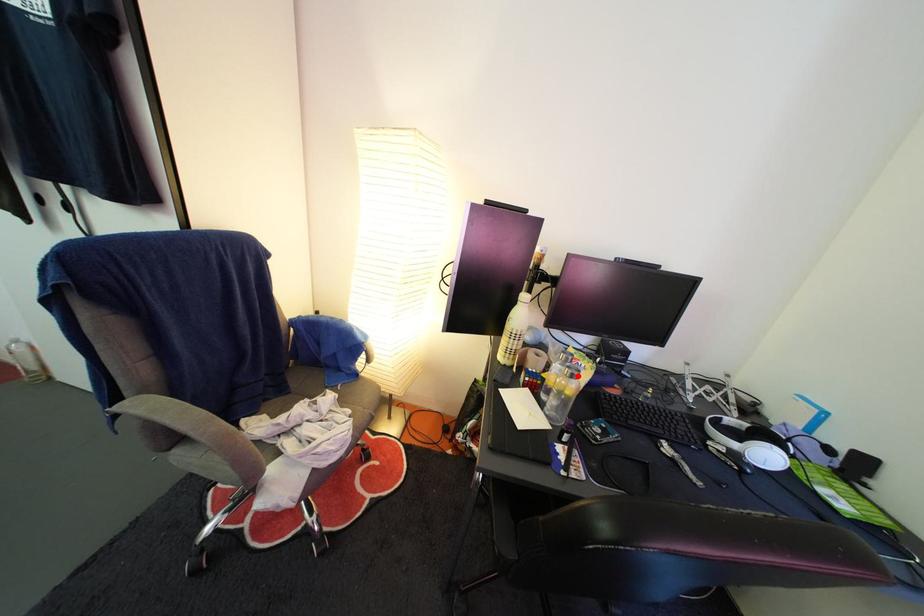
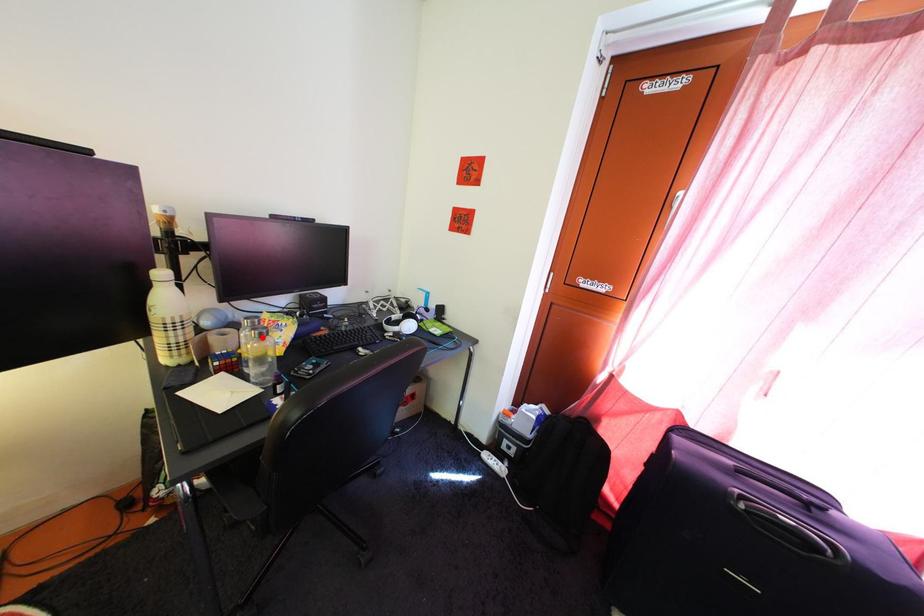
I am providing you with two images of the same scene from different viewpoints. A red point is marked on the first image and another point is marked on the second image. Is the red point in image1 aligned with the point shown in image2?

Yes